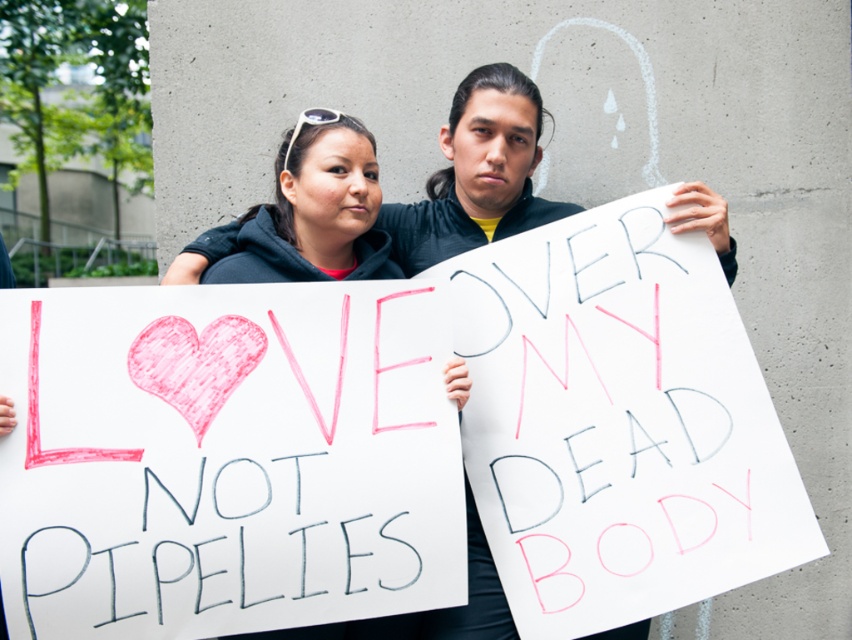
Question: Which point appears farthest from the camera in this image?

Choices:
 (A) (441, 202)
 (B) (327, 227)

Answer: (A)

Question: Which object is farther from the camera taking this photo?

Choices:
 (A) matte black jacket at center
 (B) matte black hoodie at center

Answer: (A)

Question: Does matte black jacket at center appear over matte black hoodie at center?

Choices:
 (A) yes
 (B) no

Answer: (A)

Question: Does matte black jacket at center appear on the left side of matte black hoodie at center?

Choices:
 (A) yes
 (B) no

Answer: (B)

Question: In this image, where is matte black jacket at center located relative to matte black hoodie at center?

Choices:
 (A) left
 (B) right

Answer: (B)